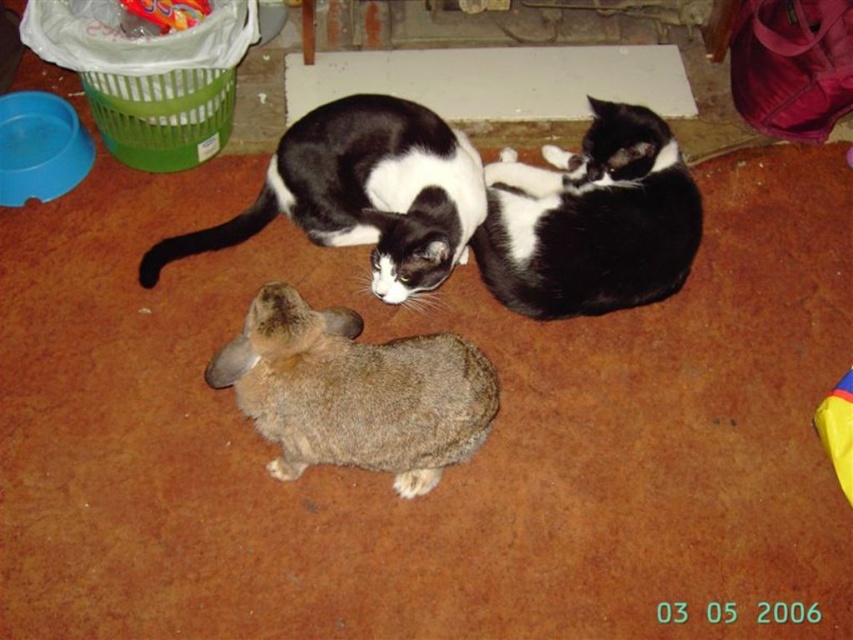
Looking at this image, is black and white fur cat at center above black and white fur cat at upper center?

Correct, black and white fur cat at center is located above black and white fur cat at upper center.

Is black and white fur cat at center smaller than black and white fur cat at upper center?

Yes, black and white fur cat at center is smaller than black and white fur cat at upper center.

Between point (677, 232) and point (398, 131), which one is positioned behind?

The point (677, 232) is behind.

Where is `black and white fur cat at center`? black and white fur cat at center is located at coordinates (590, 220).

Between fuzzy brown rabbit at center and black and white fur cat at center, which one has more height?

With more height is black and white fur cat at center.

Is the position of fuzzy brown rabbit at center less distant than that of black and white fur cat at center?

Yes, fuzzy brown rabbit at center is closer to the viewer.

Who is more forward, (305,404) or (631,211)?

Point (305,404) is more forward.

Image resolution: width=853 pixels, height=640 pixels. I want to click on fuzzy brown rabbit at center, so click(x=355, y=392).

Can you confirm if fuzzy brown rabbit at center is wider than black and white fur cat at upper center?

No.

Does fuzzy brown rabbit at center have a larger size compared to black and white fur cat at upper center?

No, fuzzy brown rabbit at center is not bigger than black and white fur cat at upper center.

Which is behind, point (437, 470) or point (372, 237)?

The point (372, 237) is more distant.

Locate an element on the screen. The width and height of the screenshot is (853, 640). fuzzy brown rabbit at center is located at coordinates (355, 392).